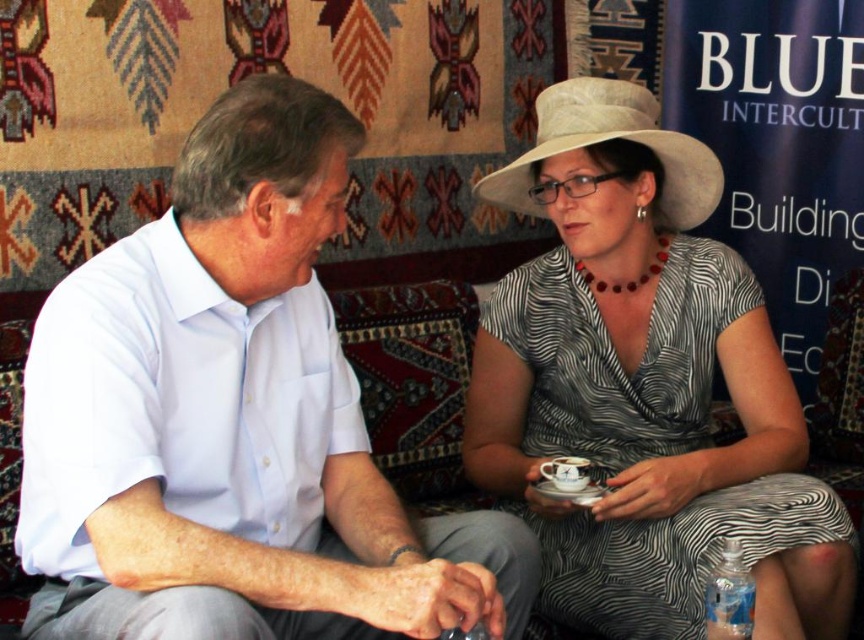
Question: Based on their relative distances, which object is farther from the beige straw hat at upper right?

Choices:
 (A) white textured hat at upper right
 (B) clear plastic bottle at lower right

Answer: (B)

Question: Observing the image, what is the correct spatial positioning of beige straw hat at upper right in reference to clear plastic bottle at lower right?

Choices:
 (A) above
 (B) below

Answer: (A)

Question: Where is white cotton shirt at center located in relation to white textured hat at upper right in the image?

Choices:
 (A) above
 (B) below

Answer: (B)

Question: Estimate the real-world distances between objects in this image. Which object is closer to the beige straw hat at upper right?

Choices:
 (A) white cotton shirt at center
 (B) white textured hat at upper right
 (C) clear plastic bottle at lower right

Answer: (B)

Question: Does white textured hat at upper right have a greater width compared to beige straw hat at upper right?

Choices:
 (A) yes
 (B) no

Answer: (A)

Question: Which of the following is the closest to the observer?

Choices:
 (A) (723, 637)
 (B) (653, 388)

Answer: (A)